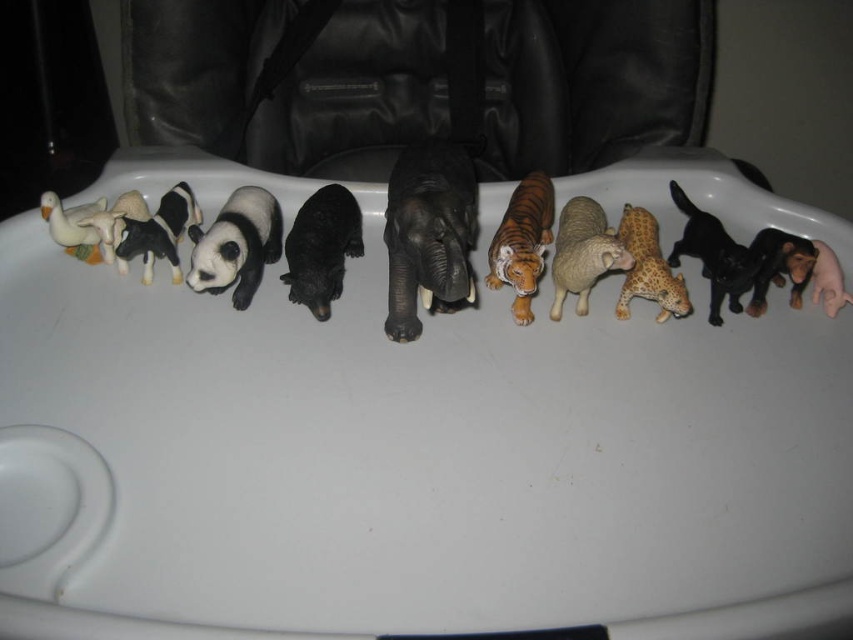
Question: Where is black rubber elephant at center located in relation to shiny brown leopard at center in the image?

Choices:
 (A) left
 (B) right

Answer: (A)

Question: Which object is farther from the camera taking this photo?

Choices:
 (A) orange matte tiger at center
 (B) white plastic bathtub at center

Answer: (A)

Question: Where is black rubber elephant at center located in relation to orange matte tiger at center in the image?

Choices:
 (A) left
 (B) right

Answer: (A)

Question: Which of the following is the farthest from the observer?

Choices:
 (A) white matte duck at left
 (B) white plastic bathtub at center
 (C) shiny brown leopard at center
 (D) black glossy cow at left

Answer: (A)

Question: Which object is closer to the camera taking this photo?

Choices:
 (A) white plastic bathtub at center
 (B) black matte panda at center
 (C) black plastic panther at right

Answer: (A)

Question: Observing the image, what is the correct spatial positioning of white plastic bathtub at center in reference to black matte bear at center?

Choices:
 (A) below
 (B) above

Answer: (A)